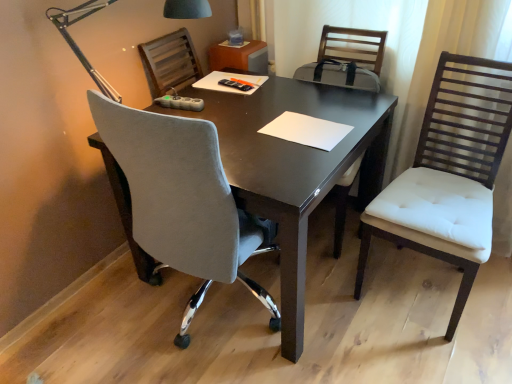
Identify the location of free location in front of white paper at center. (291, 162).